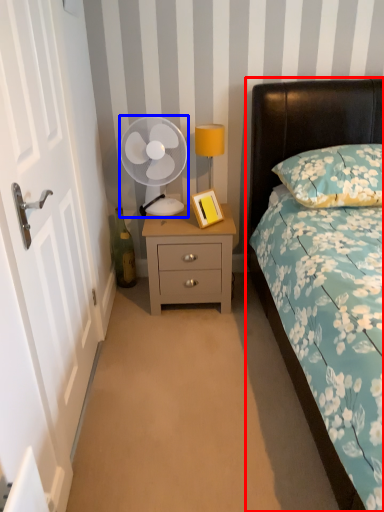
Question: Which point is further to the camera, bed (highlighted by a red box) or mechanical fan (highlighted by a blue box)?

Choices:
 (A) bed
 (B) mechanical fan

Answer: (B)